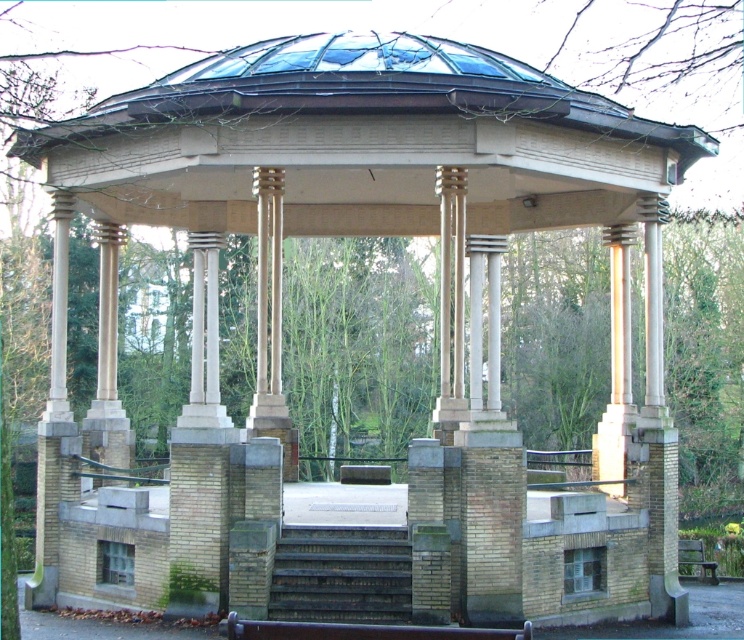
Question: Does wooden bench at center appear under green wooden bench at lower right?

Choices:
 (A) yes
 (B) no

Answer: (B)

Question: Where is wooden bench at center located in relation to green wooden bench at lower right in the image?

Choices:
 (A) above
 (B) below

Answer: (A)

Question: Which of the following is the closest to the observer?

Choices:
 (A) wooden bench at center
 (B) green wooden bench at lower right

Answer: (A)

Question: Where is wooden bench at center located in relation to green wooden bench at lower right in the image?

Choices:
 (A) above
 (B) below

Answer: (A)